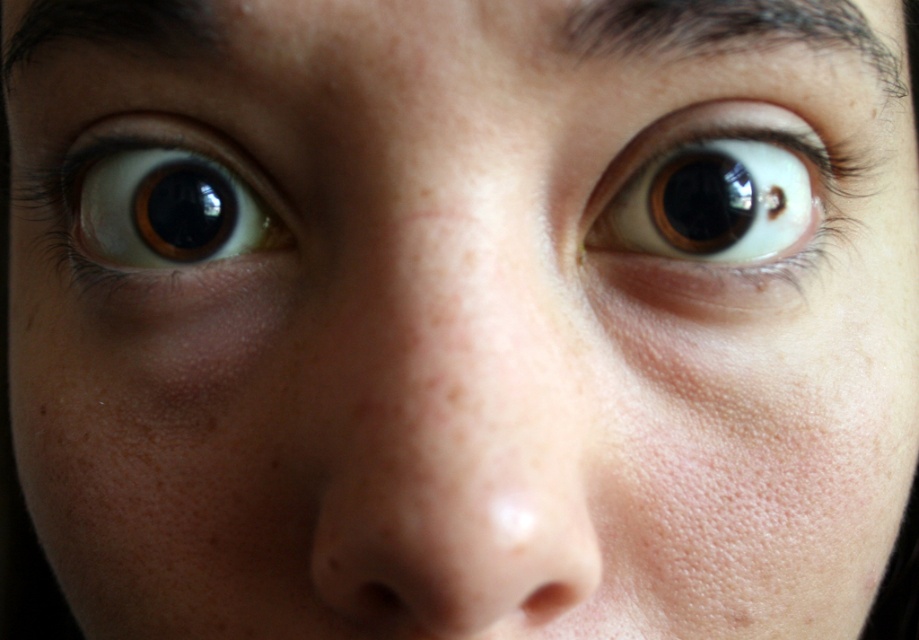
Does brown glossy eye at left have a smaller size compared to dark brown hair at upper left?

Actually, brown glossy eye at left might be larger than dark brown hair at upper left.

Which is behind, point (191, 212) or point (176, 12)?

Point (191, 212)

You are a GUI agent. You are given a task and a screenshot of the screen. Output one action in this format:
    pyautogui.click(x=<x>, y=<y>)
    Task: Click on the brown glossy eye at left
    
    Given the screenshot: What is the action you would take?
    pyautogui.click(x=157, y=202)

Does dark brown hair at upper center have a smaller size compared to dark brown hair at upper left?

Correct, dark brown hair at upper center occupies less space than dark brown hair at upper left.

Is dark brown hair at upper center below dark brown hair at upper left?

Correct, dark brown hair at upper center is located below dark brown hair at upper left.

What do you see at coordinates (727, 28) in the screenshot? The height and width of the screenshot is (640, 919). I see `dark brown hair at upper center` at bounding box center [727, 28].

I want to click on dark brown hair at upper center, so click(727, 28).

Does brown glossy eye at left appear on the right side of dark brown hair at upper center?

Incorrect, brown glossy eye at left is not on the right side of dark brown hair at upper center.

Can you confirm if brown glossy eye at left is smaller than dark brown hair at upper center?

Incorrect, brown glossy eye at left is not smaller in size than dark brown hair at upper center.

Which is in front, point (61, 198) or point (702, 12)?

Positioned in front is point (702, 12).

Image resolution: width=919 pixels, height=640 pixels. Identify the location of brown glossy eye at left. [157, 202].